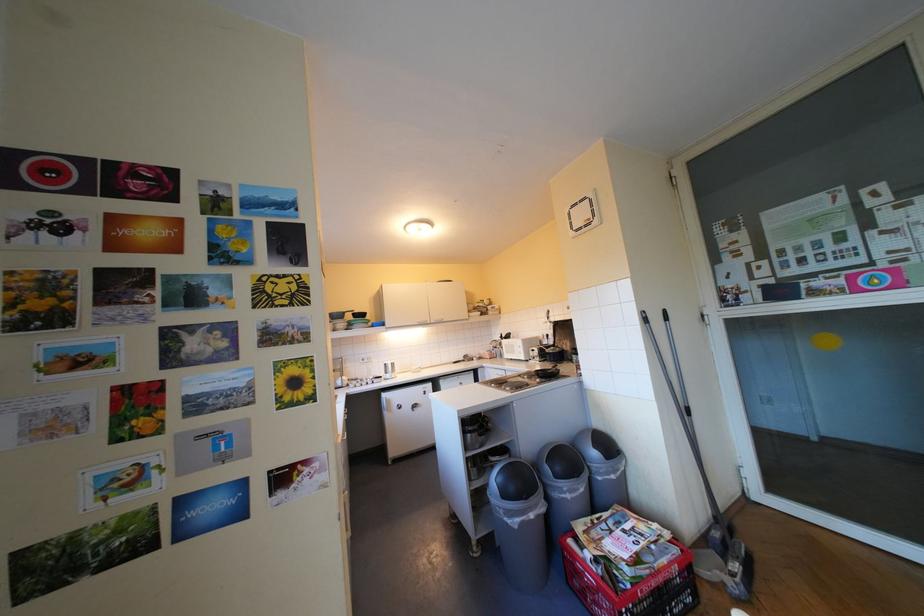
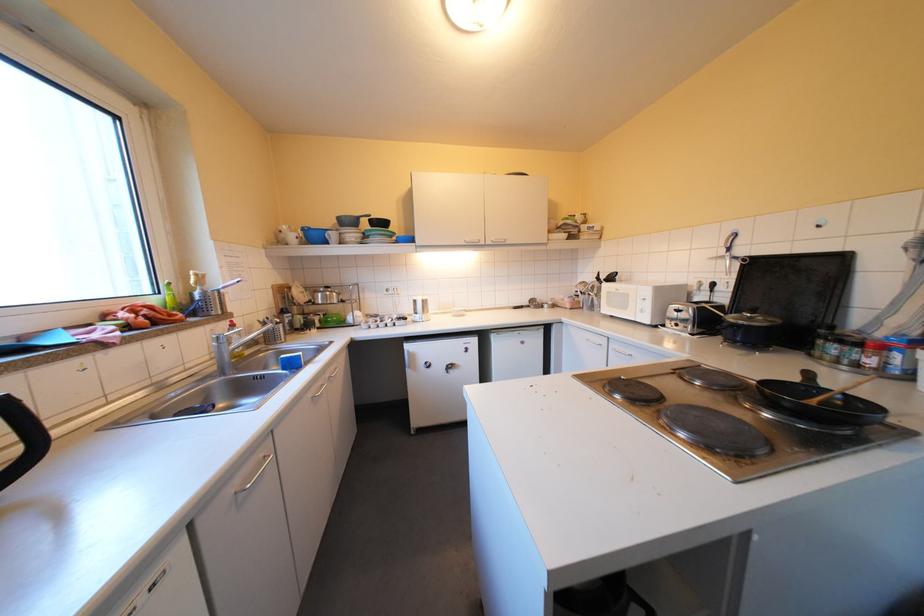
Find the pixel in the second image that matches point 419,407 in the first image.

(452, 366)